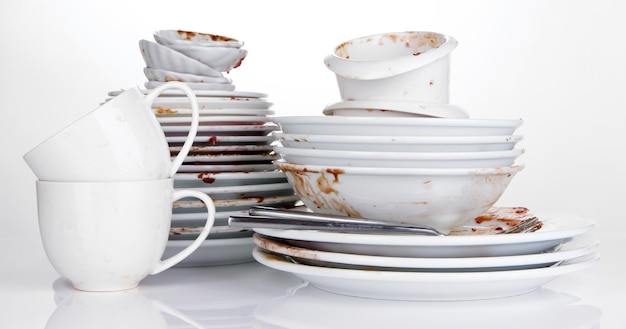
The image size is (626, 329). I want to click on cup, so click(398, 68), click(392, 107), click(207, 53), click(176, 32), click(160, 54), click(173, 66), click(198, 75), click(123, 138), click(113, 240).